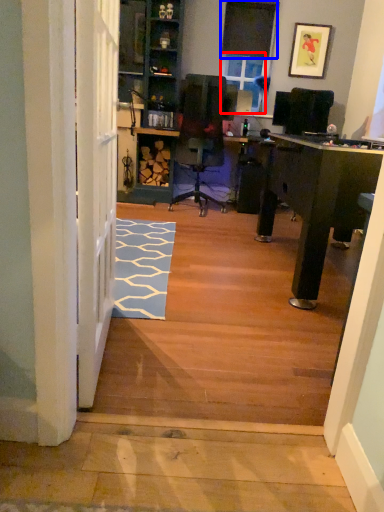
Question: Which point is further to the camera, window screen (highlighted by a red box) or window screen (highlighted by a blue box)?

Choices:
 (A) window screen
 (B) window screen

Answer: (A)